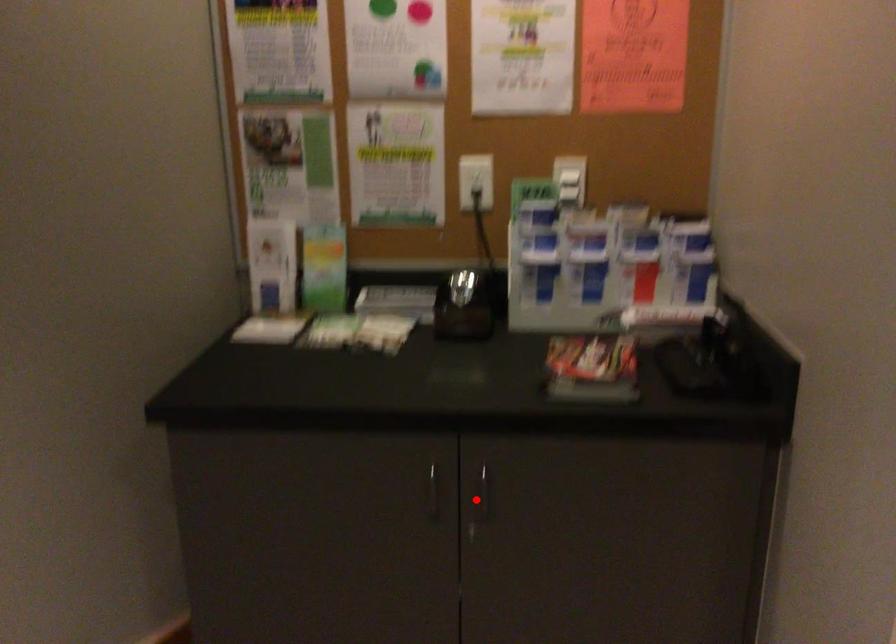
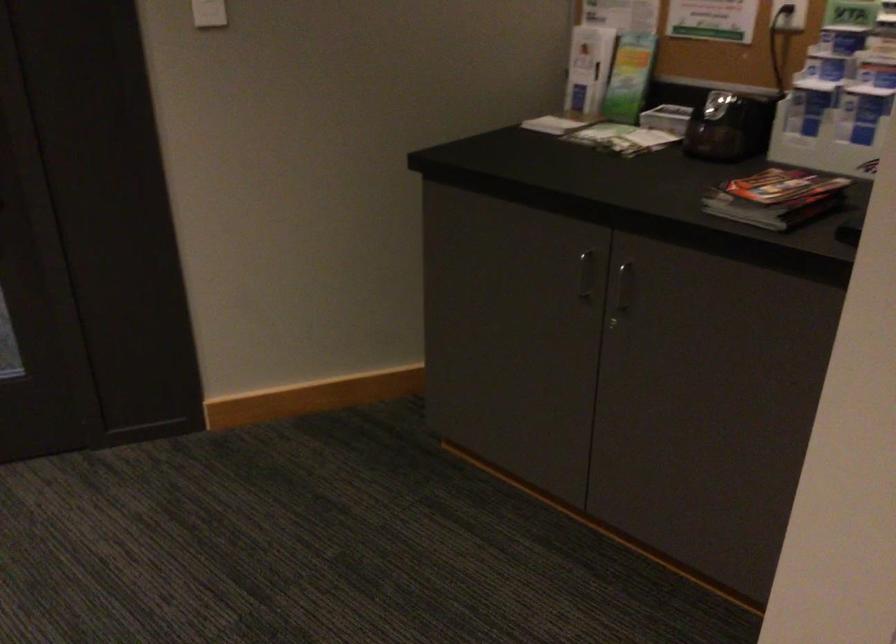
Locate, in the second image, the point that corresponds to the highlighted location in the first image.

(622, 292)